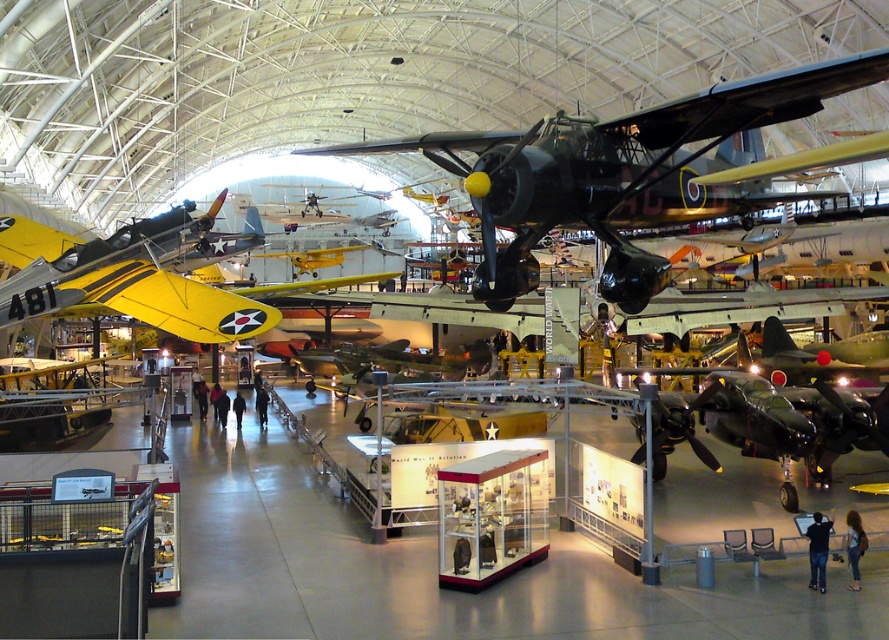
Does point (515, 200) come behind point (197, 324)?

No, (515, 200) is closer to viewer.

Is shiny black airplane at center above yellow matte airplane at left?

Incorrect, shiny black airplane at center is not positioned above yellow matte airplane at left.

Between point (551, 209) and point (4, 227), which one is positioned behind?

Positioned behind is point (4, 227).

Image resolution: width=889 pixels, height=640 pixels. I want to click on shiny black airplane at center, so click(618, 172).